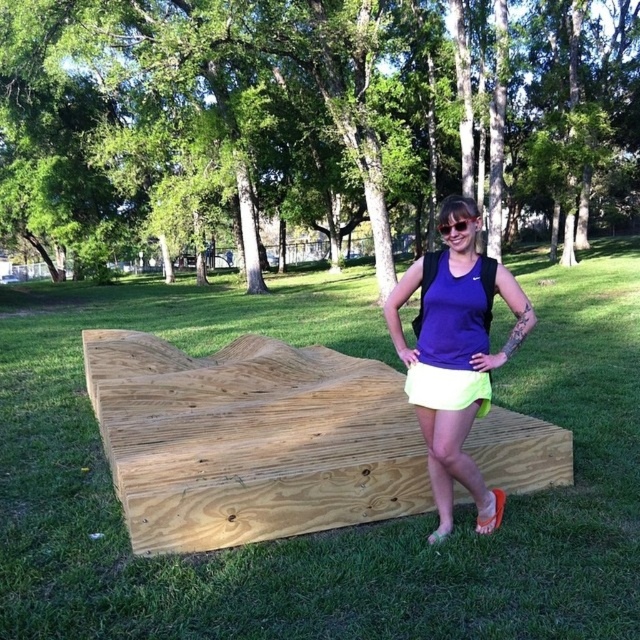
Which is above, neon yellow fabric at center or clear plastic goggles at center?

clear plastic goggles at center is higher up.

Can you confirm if neon yellow fabric at center is positioned above clear plastic goggles at center?

No.

Is point (419, 401) closer to camera compared to point (476, 218)?

No, (419, 401) is behind (476, 218).

I want to click on neon yellow fabric at center, so click(x=445, y=387).

Is point (410, 451) positioned before point (474, 225)?

No, (410, 451) is further to viewer.

Between natural wood bench at center and clear plastic goggles at center, which one is positioned higher?

clear plastic goggles at center

Who is more distant from viewer, [310,525] or [472,221]?

Positioned behind is point [310,525].

Where is `natural wood bench at center`? This screenshot has height=640, width=640. natural wood bench at center is located at coordinates click(x=250, y=440).

Is green grass at center to the right of clear plastic goggles at center from the viewer's perspective?

No, green grass at center is not to the right of clear plastic goggles at center.

Is green grass at center positioned before clear plastic goggles at center?

Yes, green grass at center is in front of clear plastic goggles at center.

At what (x,y) coordinates should I click in order to perform the action: click on green grass at center. Please return your answer as a coordinate pair (x, y). The width and height of the screenshot is (640, 640). Looking at the image, I should click on (337, 529).

At what (x,y) coordinates should I click in order to perform the action: click on green grass at center. Please return your answer as a coordinate pair (x, y). Looking at the image, I should click on (337, 529).